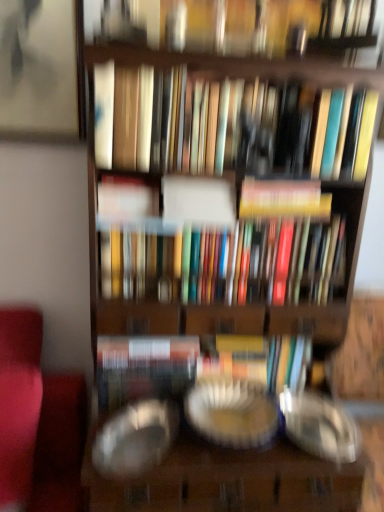
Question: Can you confirm if matte white book at center, acting as the second book starting from the top, is taller than hardcover book at center, positioned as the second book in bottom-to-top order?

Choices:
 (A) no
 (B) yes

Answer: (A)

Question: Is matte white book at center, which is the third book from bottom to top, behind hardcover book at center, marked as the third book in a top-to-bottom arrangement?

Choices:
 (A) no
 (B) yes

Answer: (A)

Question: Is matte white book at center, acting as the second book starting from the top, at the left side of hardcover book at center, marked as the third book in a top-to-bottom arrangement?

Choices:
 (A) yes
 (B) no

Answer: (A)

Question: From the image's perspective, is matte white book at center, acting as the second book starting from the top, beneath hardcover book at center, marked as the third book in a top-to-bottom arrangement?

Choices:
 (A) no
 (B) yes

Answer: (A)

Question: Does matte white book at center, which is the third book from bottom to top, have a lesser height compared to hardcover book at center, marked as the third book in a top-to-bottom arrangement?

Choices:
 (A) yes
 (B) no

Answer: (A)

Question: From their relative heights in the image, would you say multicolored hardcover books at center, arranged as the fourth book when viewed from the top, is taller or shorter than matte white book at center, which is the third book from bottom to top?

Choices:
 (A) tall
 (B) short

Answer: (A)

Question: Looking at the image, does multicolored hardcover books at center, arranged as the first book when ordered from the bottom, seem bigger or smaller compared to matte white book at center, which is the third book from bottom to top?

Choices:
 (A) big
 (B) small

Answer: (A)

Question: Would you say multicolored hardcover books at center, arranged as the first book when ordered from the bottom, is inside or outside matte white book at center, which is the third book from bottom to top?

Choices:
 (A) outside
 (B) inside

Answer: (A)

Question: From a real-world perspective, is multicolored hardcover books at center, arranged as the first book when ordered from the bottom, positioned above or below matte white book at center, acting as the second book starting from the top?

Choices:
 (A) above
 (B) below

Answer: (B)

Question: From the image's perspective, relative to transparent glass plate at center, the 1th glass plate viewed from the left, is multicolored hardcover books at center, arranged as the first book when ordered from the bottom, above or below?

Choices:
 (A) below
 (B) above

Answer: (B)

Question: Would you say multicolored hardcover books at center, arranged as the first book when ordered from the bottom, is inside or outside transparent glass plate at center, which ranks as the second glass plate in right-to-left order?

Choices:
 (A) outside
 (B) inside

Answer: (A)

Question: Relative to transparent glass plate at center, which ranks as the second glass plate in right-to-left order, is multicolored hardcover books at center, arranged as the first book when ordered from the bottom, in front or behind?

Choices:
 (A) behind
 (B) front

Answer: (A)

Question: Is point (296, 224) closer or farther from the camera than point (127, 475)?

Choices:
 (A) closer
 (B) farther

Answer: (B)

Question: Relative to transparent glass plate at center, the first glass plate positioned from the right, is transparent glass plate at center, the 1th glass plate viewed from the left, in front or behind?

Choices:
 (A) front
 (B) behind

Answer: (A)

Question: Is point (163, 440) positioned closer to the camera than point (187, 396)?

Choices:
 (A) closer
 (B) farther

Answer: (A)